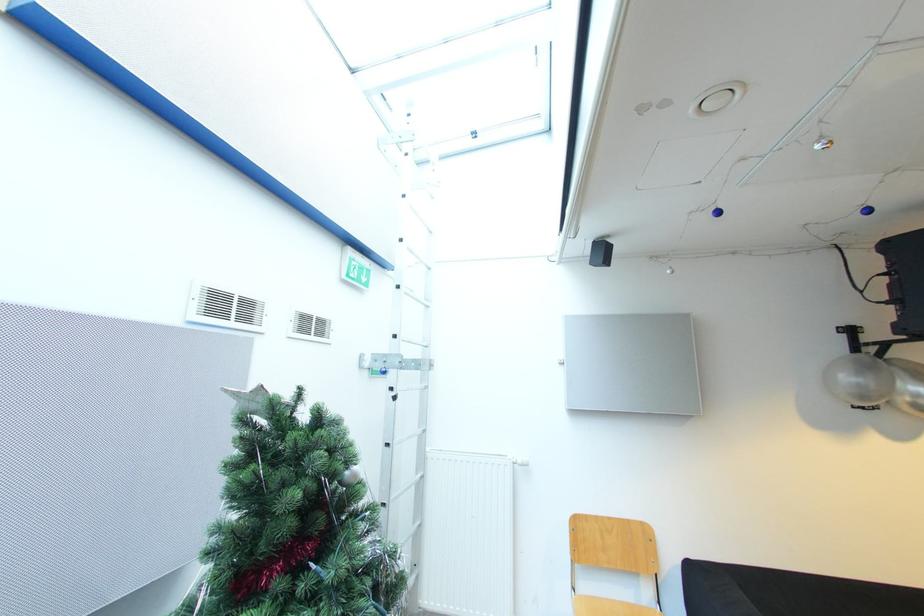
You are a GUI agent. You are given a task and a screenshot of the screen. Output one action in this format:
    pyautogui.click(x=<x>, y=<y>)
    Task: Click on the tree star topper
    Image resolution: width=924 pixels, height=616 pixels.
    Given the screenshot: What is the action you would take?
    pyautogui.click(x=294, y=522)